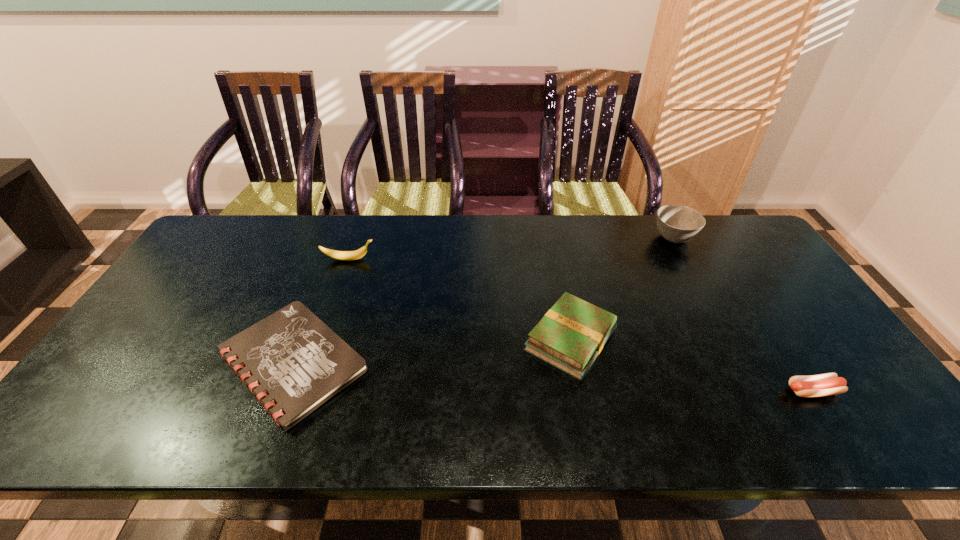
I want to click on vacant space located on the left of the shortest object, so click(x=156, y=362).

This screenshot has height=540, width=960. Find the location of `bowl that is positioned at the far edge`. bowl that is positioned at the far edge is located at coordinates (676, 223).

At what (x,y) coordinates should I click in order to perform the action: click on banana positioned at the far edge. Please return your answer as a coordinate pair (x, y). The width and height of the screenshot is (960, 540). Looking at the image, I should click on (357, 254).

I want to click on object situated at the near edge, so click(x=293, y=362).

Image resolution: width=960 pixels, height=540 pixels. In order to click on object that is at the right edge in this screenshot , I will do `click(827, 384)`.

Where is `free location at the far edge of the desktop`? Image resolution: width=960 pixels, height=540 pixels. free location at the far edge of the desktop is located at coordinates (251, 246).

Where is `free space at the left edge`? free space at the left edge is located at coordinates (198, 309).

The height and width of the screenshot is (540, 960). In the image, there is a desktop. Find the location of `vacant space at the right edge`. vacant space at the right edge is located at coordinates (819, 404).

Find the location of a particular element. blank space at the far left corner of the desktop is located at coordinates [205, 239].

Where is `free space at the near left corner`? The width and height of the screenshot is (960, 540). free space at the near left corner is located at coordinates (99, 411).